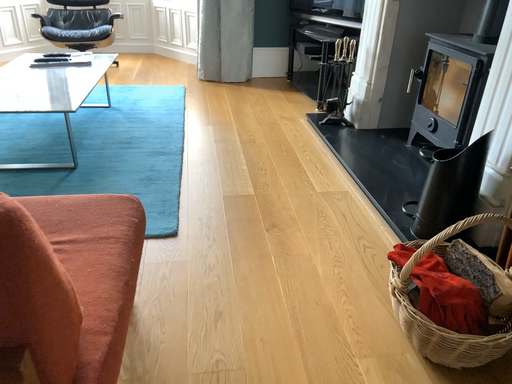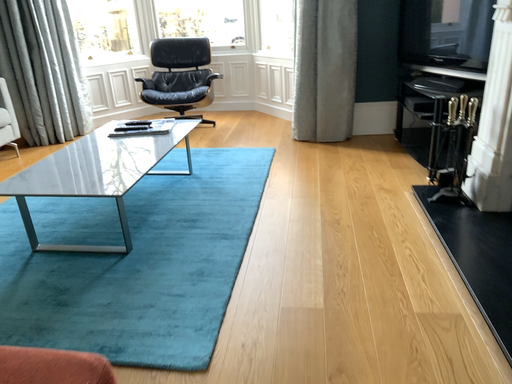
Question: Which way did the camera rotate in the video?

Choices:
 (A) rotated left
 (B) rotated right

Answer: (A)